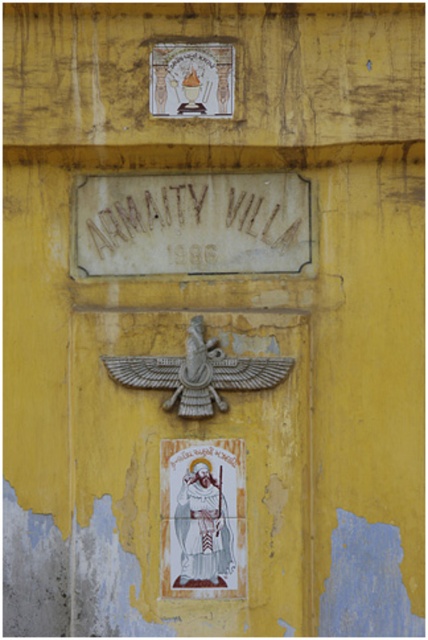
Question: Does brown stone sign at center come in front of white glossy saint at center?

Choices:
 (A) no
 (B) yes

Answer: (A)

Question: Among these points, which one is farthest from the camera?

Choices:
 (A) (175, 58)
 (B) (204, 467)
 (C) (128, 200)

Answer: (C)

Question: Is brown stone sign at center thinner than white glossy saint at center?

Choices:
 (A) yes
 (B) no

Answer: (B)

Question: Based on their relative distances, which object is nearer to the matte white stone plaque at upper center?

Choices:
 (A) white glossy saint at center
 (B) brown stone sign at center

Answer: (B)

Question: Which object is closer to the camera taking this photo?

Choices:
 (A) white glossy saint at center
 (B) brown stone sign at center

Answer: (A)

Question: Does white glossy saint at center have a larger size compared to matte white stone plaque at upper center?

Choices:
 (A) no
 (B) yes

Answer: (B)